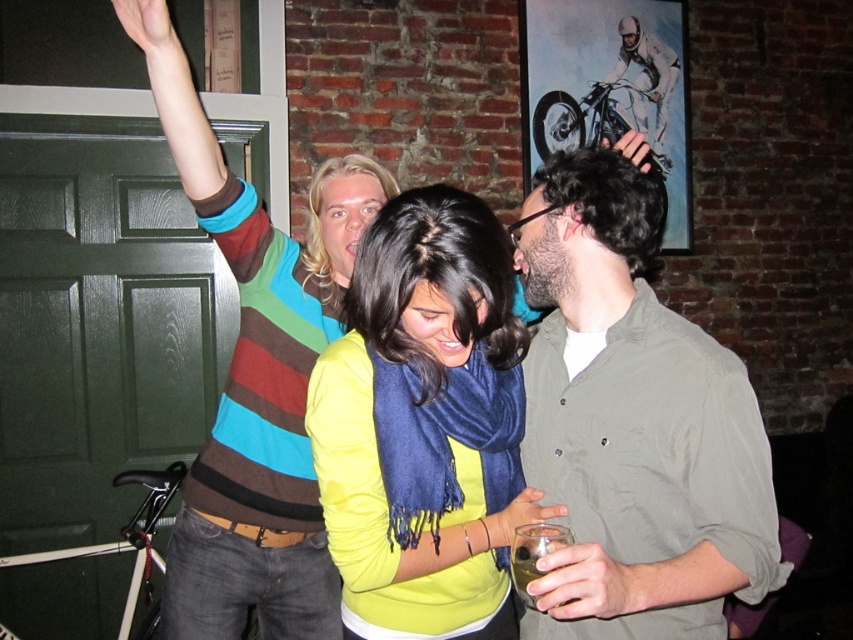
From the picture: Who is more distant from viewer, (364, 426) or (532, 609)?

The point (532, 609) is more distant.

Identify the location of yellow matte sweater at center. (422, 410).

Does point (599, 550) come in front of point (461, 368)?

Yes, it is in front of point (461, 368).

Does matte green shirt at center appear under yellow matte sweater at center?

Incorrect, matte green shirt at center is not positioned below yellow matte sweater at center.

Measure the distance between point (654, 579) and camera.

They are 1.08 meters apart.

Locate an element on the screen. This screenshot has height=640, width=853. matte green shirt at center is located at coordinates (633, 422).

Looking at this image, which is more to the right, matte green shirt at center or translucent glass at lower center?

From the viewer's perspective, matte green shirt at center appears more on the right side.

Describe the element at coordinates (633, 422) in the screenshot. This screenshot has width=853, height=640. I see `matte green shirt at center` at that location.

Locate an element on the screen. The height and width of the screenshot is (640, 853). matte green shirt at center is located at coordinates (633, 422).